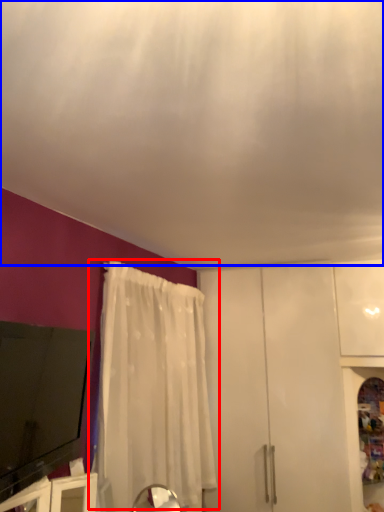
Question: Which point is further to the camera, curtain (highlighted by a red box) or blind (highlighted by a blue box)?

Choices:
 (A) curtain
 (B) blind

Answer: (A)